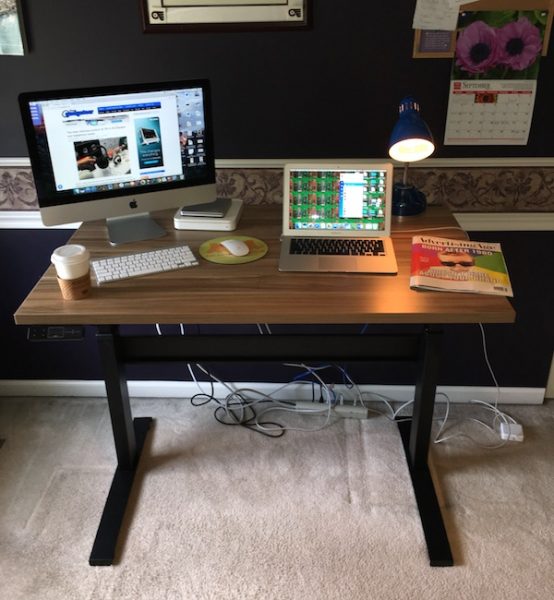
Where is `mirror`? mirror is located at coordinates (17, 35).